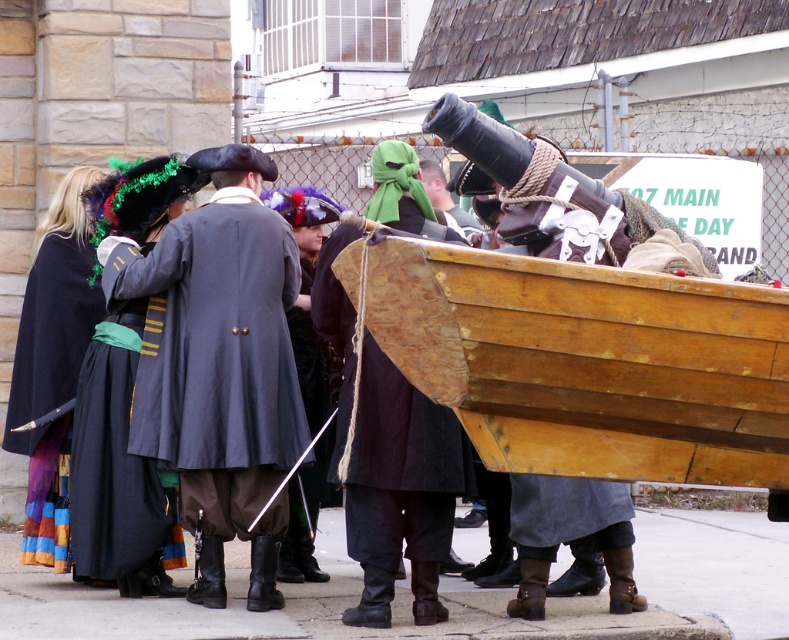
You are standing at point (268, 248). The nearest exit is 22.62 meters away. Can you reach the nearest exit within 10 seconds if you run at 3 m per second?

The distance to the nearest exit is 22.62 meters. Running at 3 m per second, it would take approximately 7.54 seconds, so yes, you can reach the nearest exit within 10 seconds.

You are an event organizer checking the setup for the reenactment. You need to ensure that the wooden boat at center does not block the view of the matte gray coat at center for the audience. Is the current arrangement acceptable?

The wooden boat at center has a lesser height compared to matte gray coat at center, so the boat is shorter and therefore less likely to block the view of the matte gray coat at center. The current arrangement is acceptable.